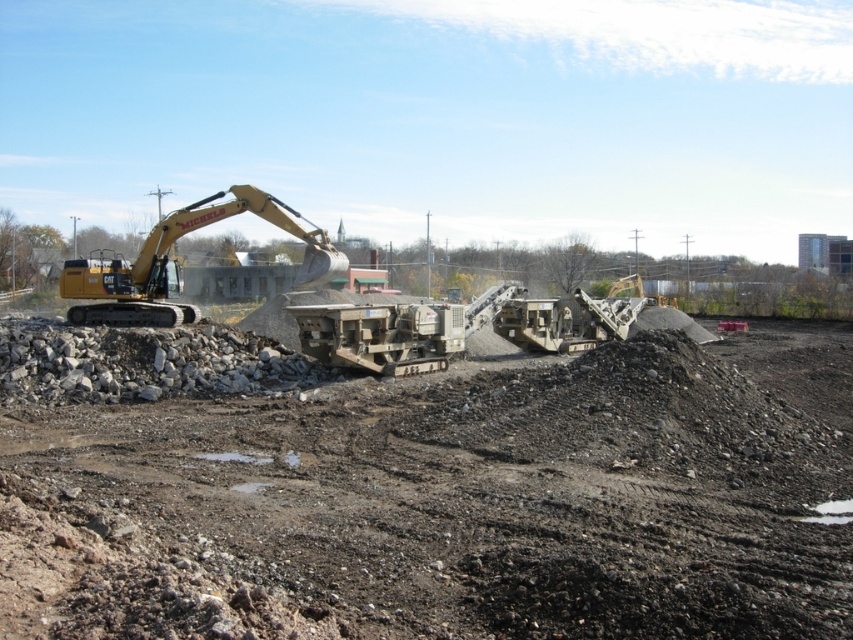
Can you confirm if dull brown soil at center is positioned above yellow metallic excavator at center-left?

No.

Is dull brown soil at center bigger than yellow metallic excavator at center-left?

Incorrect, dull brown soil at center is not larger than yellow metallic excavator at center-left.

Is point (1, 634) closer to camera compared to point (120, 298)?

Yes, it is in front of point (120, 298).

Locate an element on the screen. The image size is (853, 640). dull brown soil at center is located at coordinates 448,502.